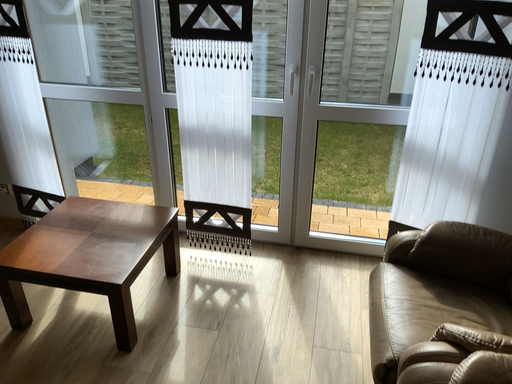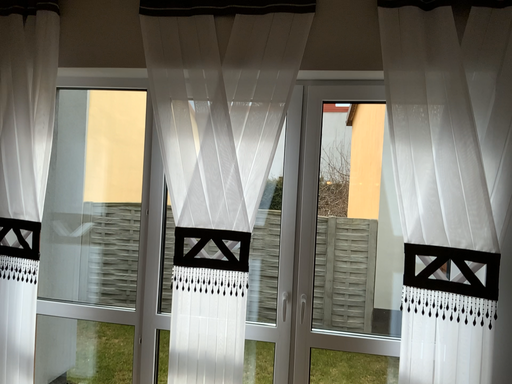
Question: Which way did the camera rotate in the video?

Choices:
 (A) rotated upward
 (B) rotated downward

Answer: (A)